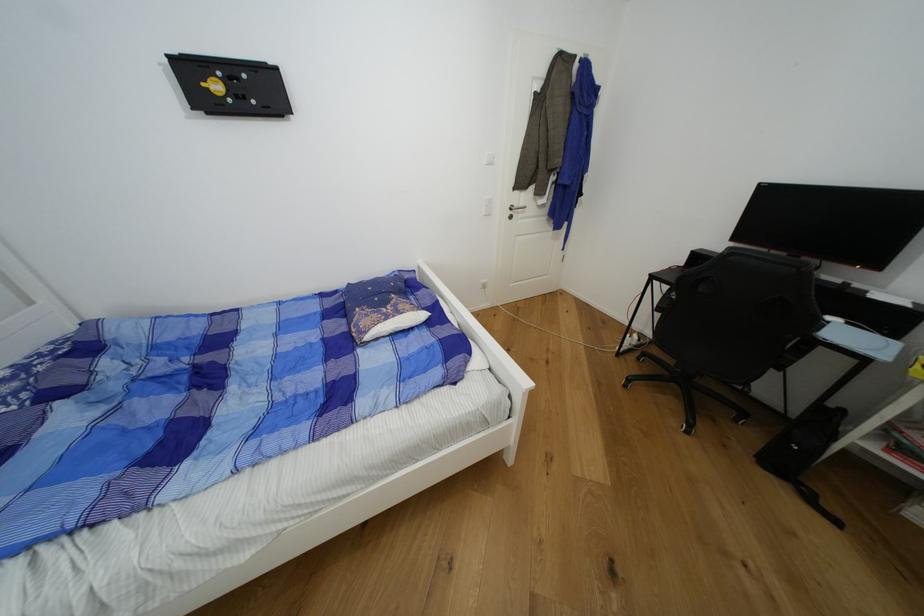
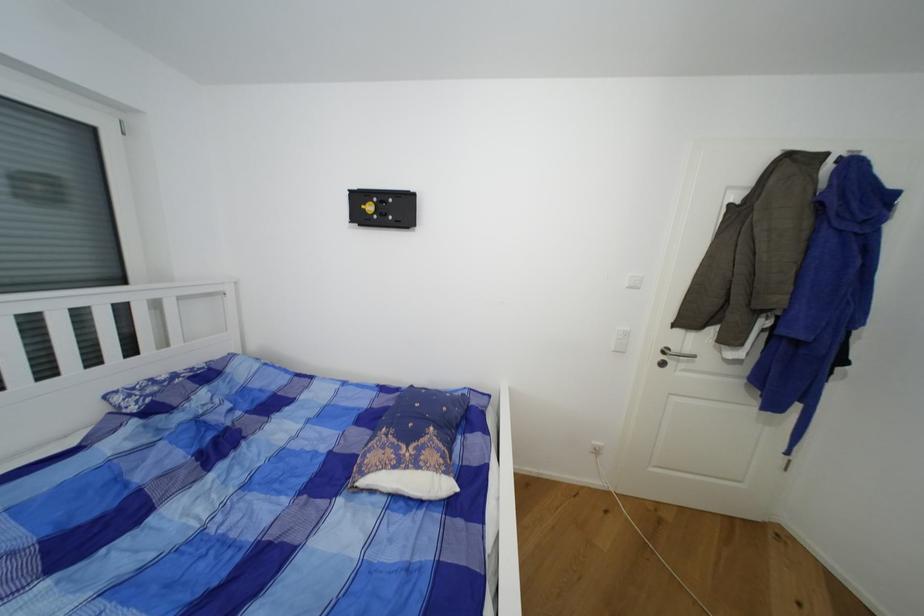
In the second image, find the point that corresponds to the point at 209,86 in the first image.

(369, 208)